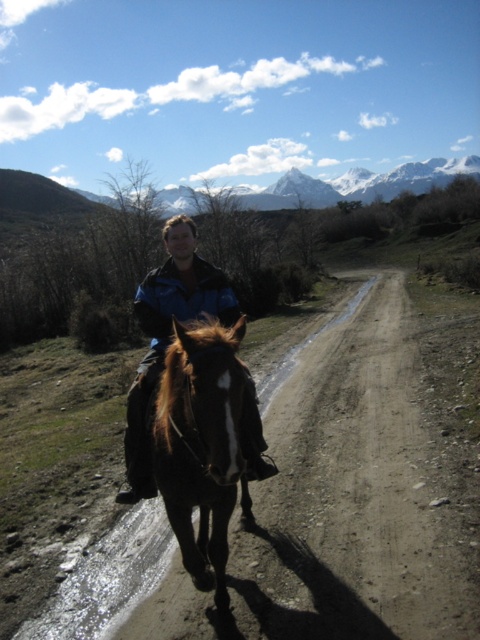
You are a hiker trying to navigate the path in the image. You see two points marked on the map at coordinates point (214, 508) and point (158, 346). If you are facing the direction of the mountains, which point should you head towards first to stay on the correct path?

Point (214, 508) is in front of point (158, 346), so you should head towards point (214, 508) first to stay on the correct path.

From the picture: You are a photographer trying to capture a clear photo of the brown glossy horse at center and the blue jacket at center. The camera you are using has a depth of field that can focus on objects within a 16 inches range. Will both subjects be in focus?

The brown glossy horse at center and blue jacket at center are 16.32 inches apart from each other. Since the distance between them exceeds the camera s 16 inches depth of field range, both subjects might not be in focus simultaneously.